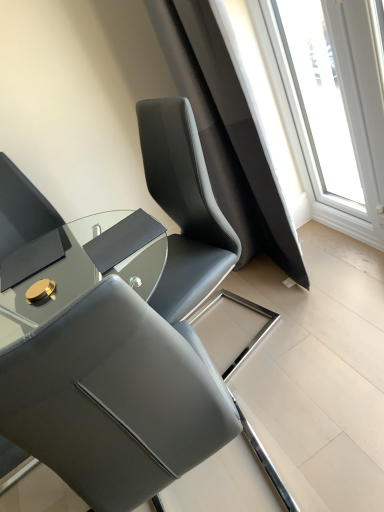
At what (x,y) coordinates should I click in order to perform the action: click on free location to the right of matte gray chair at center. Please return your answer as a coordinate pair (x, y). Looking at the image, I should click on (319, 357).